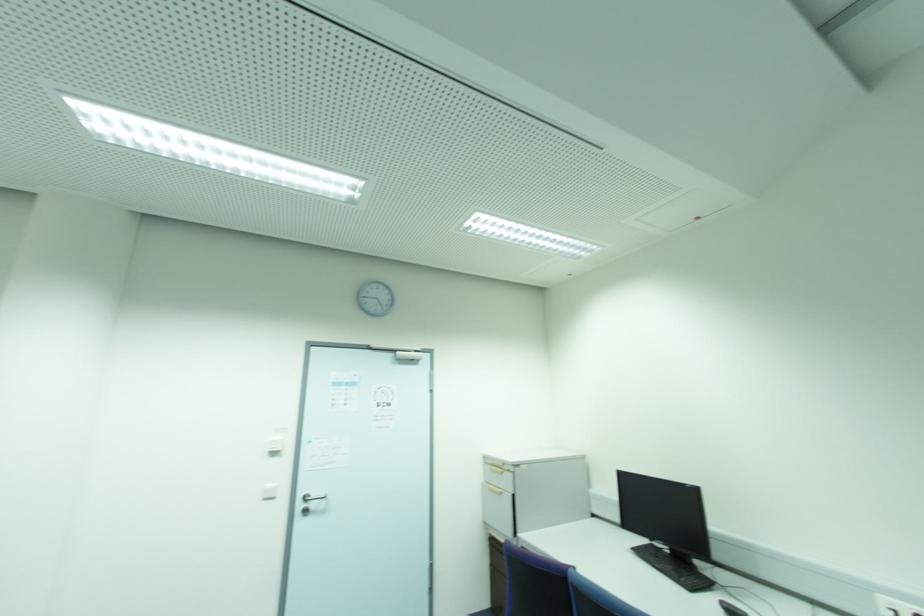
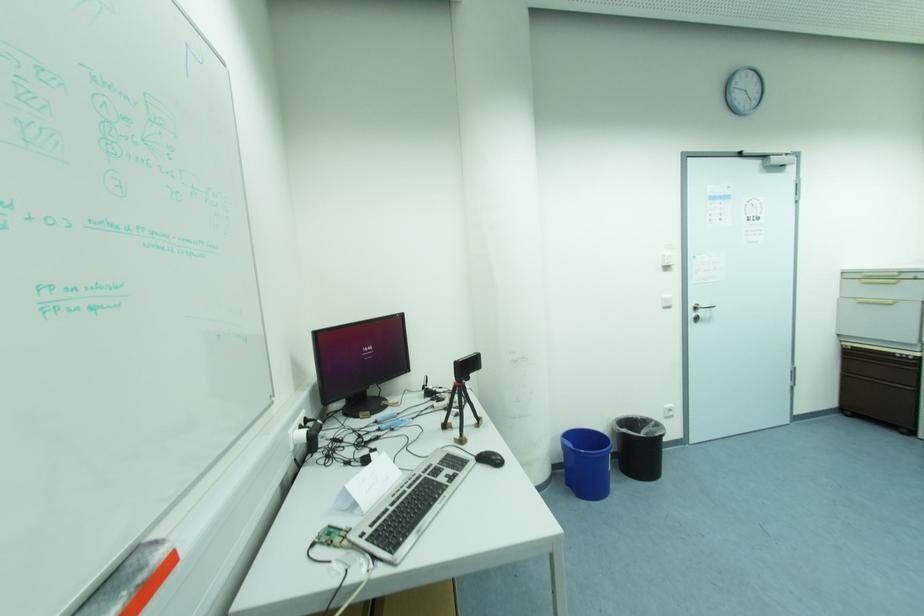
Question: What movement of the cameraman would produce the second image?

Choices:
 (A) Left
 (B) Right
 (C) Forward
 (D) Backward

Answer: (A)